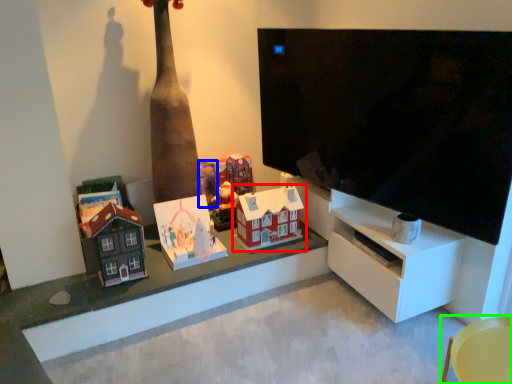
Question: Which is farther away from toy (highlighted by a red box)? toy (highlighted by a blue box) or furniture (highlighted by a green box)?

Choices:
 (A) toy
 (B) furniture

Answer: (B)